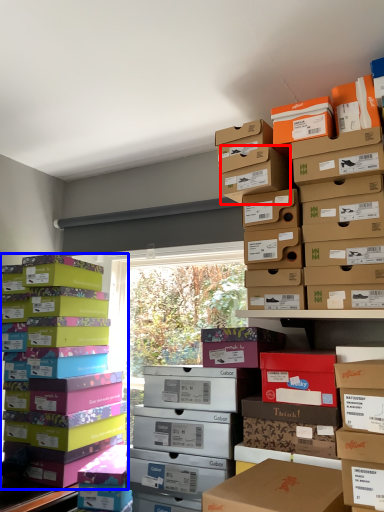
Question: Which of the following is the farthest to the observer, storage box (highlighted by a red box) or box (highlighted by a blue box)?

Choices:
 (A) storage box
 (B) box

Answer: (B)